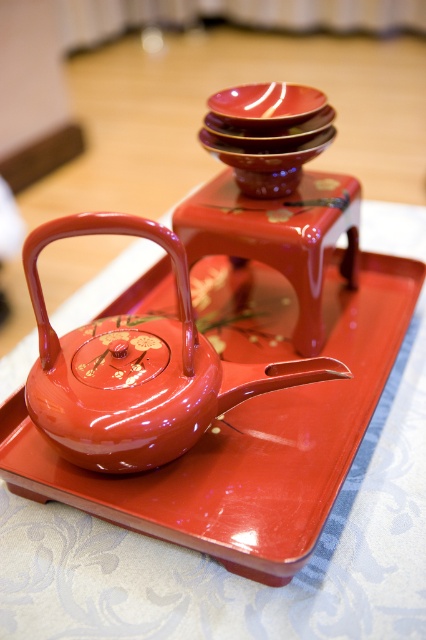
Does glossy lacquer teapot at center appear on the right side of glossy ceramic plate at upper center?

No, glossy lacquer teapot at center is not to the right of glossy ceramic plate at upper center.

Who is more distant from viewer, [124,314] or [301,122]?

The point [124,314] is more distant.

Where is `glossy lacquer teapot at center`? Image resolution: width=426 pixels, height=640 pixels. glossy lacquer teapot at center is located at coordinates (138, 368).

Consider the image. Is glossy fabric tray at center to the right of glossy lacquer teapot at center from the viewer's perspective?

Yes, glossy fabric tray at center is to the right of glossy lacquer teapot at center.

Is glossy fabric tray at center closer to the viewer compared to glossy lacquer teapot at center?

No, it is behind glossy lacquer teapot at center.

Which is behind, point (245, 609) or point (256, 380)?

The point (256, 380) is more distant.

Image resolution: width=426 pixels, height=640 pixels. I want to click on glossy fabric tray at center, so click(x=224, y=570).

Can you confirm if glossy fabric tray at center is thinner than glossy ceramic plate at upper center?

No.

Looking at this image, is glossy fabric tray at center wider than glossy ceramic plate at upper center?

Yes.

In the scene shown: Measure the distance between glossy fabric tray at center and camera.

The distance of glossy fabric tray at center from camera is 24.48 inches.

Where is `glossy fabric tray at center`? The image size is (426, 640). glossy fabric tray at center is located at coordinates (224, 570).